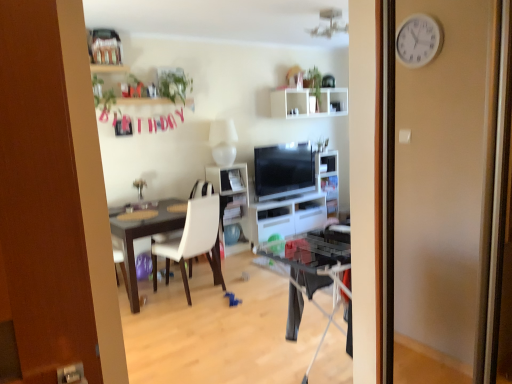
Question: Considering the relative positions of white matte shelf at upper center, marked as the 2th shelf in a left-to-right arrangement, and matte black tv at center in the image provided, is white matte shelf at upper center, marked as the 2th shelf in a left-to-right arrangement, to the left of matte black tv at center from the viewer's perspective?

Choices:
 (A) no
 (B) yes

Answer: (A)

Question: Could you tell me if white matte shelf at upper center, the second shelf viewed from the front, is turned towards matte black tv at center?

Choices:
 (A) yes
 (B) no

Answer: (B)

Question: From a real-world perspective, is white matte shelf at upper center, the second shelf viewed from the front, over matte black tv at center?

Choices:
 (A) no
 (B) yes

Answer: (B)

Question: Is white matte shelf at upper center, marked as the 2th shelf in a left-to-right arrangement, outside of matte black tv at center?

Choices:
 (A) yes
 (B) no

Answer: (A)

Question: From the image's perspective, is white matte shelf at upper center, the second shelf viewed from the front, above matte black tv at center?

Choices:
 (A) no
 (B) yes

Answer: (B)

Question: Based on their positions, is green leafy plant at upper center located to the left or right of white glossy shelf at center, which ranks as the 2th shelf in back-to-front order?

Choices:
 (A) right
 (B) left

Answer: (B)

Question: Considering the positions of green leafy plant at upper center and white glossy shelf at center, which ranks as the 2th shelf in back-to-front order, in the image, is green leafy plant at upper center wider or thinner than white glossy shelf at center, which ranks as the 2th shelf in back-to-front order,?

Choices:
 (A) thin
 (B) wide

Answer: (A)

Question: From the image's perspective, relative to white glossy shelf at center, which is the first shelf from left to right, is green leafy plant at upper center above or below?

Choices:
 (A) below
 (B) above

Answer: (B)

Question: From their relative heights in the image, would you say green leafy plant at upper center is taller or shorter than white glossy shelf at center, acting as the 1th shelf starting from the bottom?

Choices:
 (A) short
 (B) tall

Answer: (A)

Question: From the image's perspective, is green leafy plant at upper center above or below white matte shelf at upper center, marked as the 2th shelf in a bottom-to-top arrangement?

Choices:
 (A) below
 (B) above

Answer: (A)

Question: Does point (167, 94) appear closer or farther from the camera than point (301, 112)?

Choices:
 (A) closer
 (B) farther

Answer: (A)

Question: Is green leafy plant at upper center bigger or smaller than white matte shelf at upper center, arranged as the first shelf when viewed from the back?

Choices:
 (A) small
 (B) big

Answer: (A)

Question: From their relative heights in the image, would you say green leafy plant at upper center is taller or shorter than white matte shelf at upper center, the second shelf viewed from the front?

Choices:
 (A) short
 (B) tall

Answer: (B)

Question: Choose the correct answer: Is white matte shelf at upper center, the first shelf viewed from the right, inside white glossy cabinet at center or outside it?

Choices:
 (A) outside
 (B) inside

Answer: (A)

Question: Based on their positions, is white matte shelf at upper center, the first shelf viewed from the right, located to the left or right of white glossy cabinet at center?

Choices:
 (A) left
 (B) right

Answer: (B)